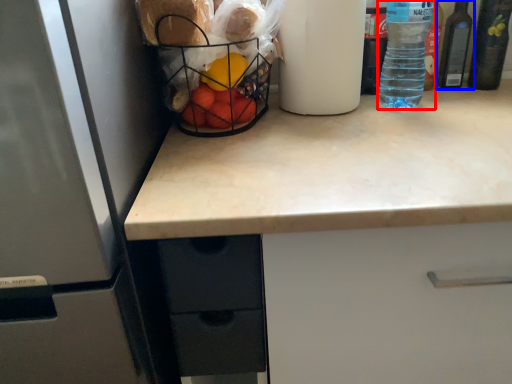
Question: Which point is closer to the camera, bottle (highlighted by a red box) or bottle (highlighted by a blue box)?

Choices:
 (A) bottle
 (B) bottle

Answer: (A)